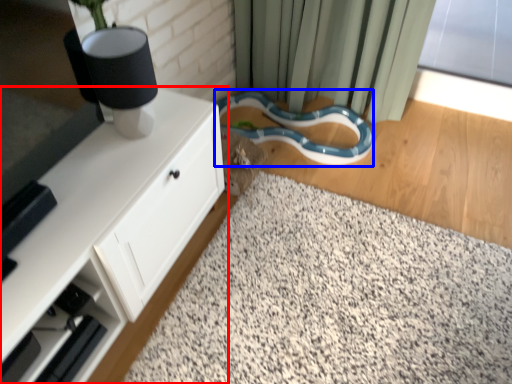
Question: Which point is closer to the camera, cabinetry (highlighted by a red box) or snake (highlighted by a blue box)?

Choices:
 (A) cabinetry
 (B) snake

Answer: (A)